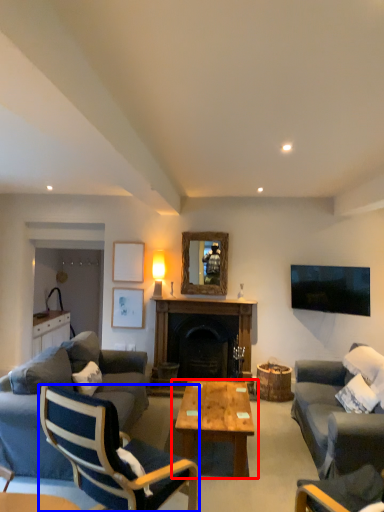
Question: Which object is further to the camera taking this photo, coffee table (highlighted by a red box) or chair (highlighted by a blue box)?

Choices:
 (A) coffee table
 (B) chair

Answer: (A)